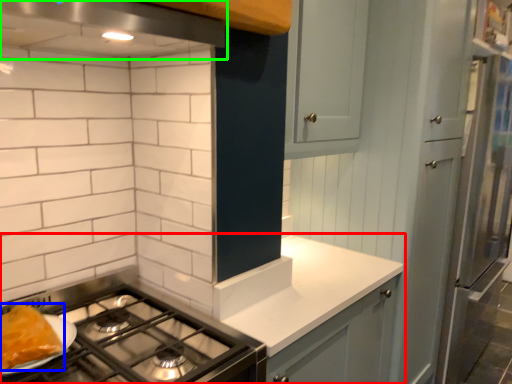
Question: Which object is the closest to the countertop (highlighted by a red box)? Choose among these: food (highlighted by a blue box) or exhaust hood (highlighted by a green box).

Choices:
 (A) food
 (B) exhaust hood

Answer: (A)